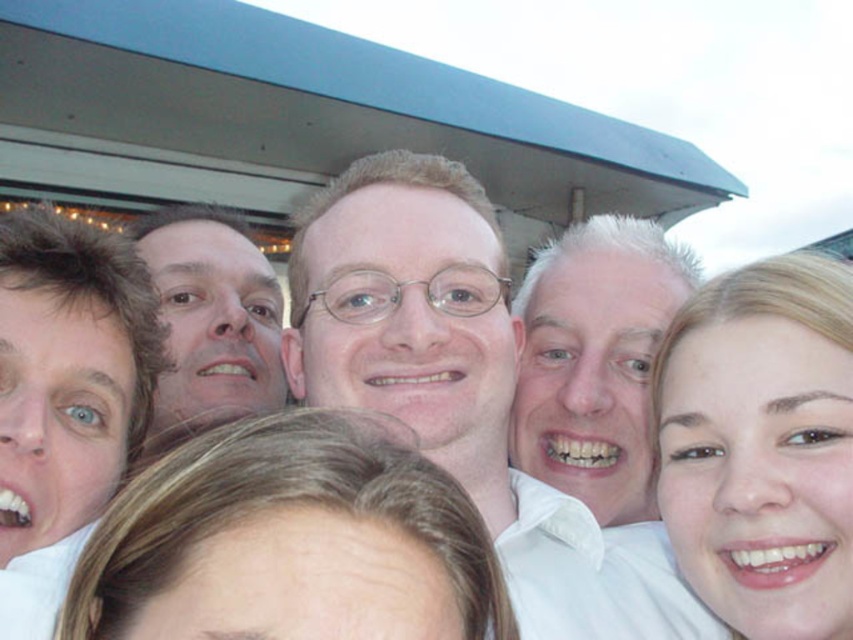
Does blonde hair at center have a greater height compared to smooth skin face at center?

In fact, blonde hair at center may be shorter than smooth skin face at center.

Does blonde hair at center appear on the left side of smooth skin face at center?

No, blonde hair at center is not to the left of smooth skin face at center.

Who is more distant from viewer, (137,531) or (206,289)?

The point (206,289) is behind.

The width and height of the screenshot is (853, 640). Identify the location of blonde hair at center. (289, 540).

Is blonde hair at center taller than white glossy shirt at center?

No, blonde hair at center is not taller than white glossy shirt at center.

Who is shorter, blonde hair at center or white glossy shirt at center?

With less height is blonde hair at center.

What do you see at coordinates (289, 540) in the screenshot? The width and height of the screenshot is (853, 640). I see `blonde hair at center` at bounding box center [289, 540].

The width and height of the screenshot is (853, 640). What are the coordinates of `blonde hair at center` in the screenshot? It's located at (289, 540).

Does smooth blonde hair at center have a smaller size compared to white glossy shirt at center?

Yes.

The image size is (853, 640). Identify the location of smooth blonde hair at center. (762, 445).